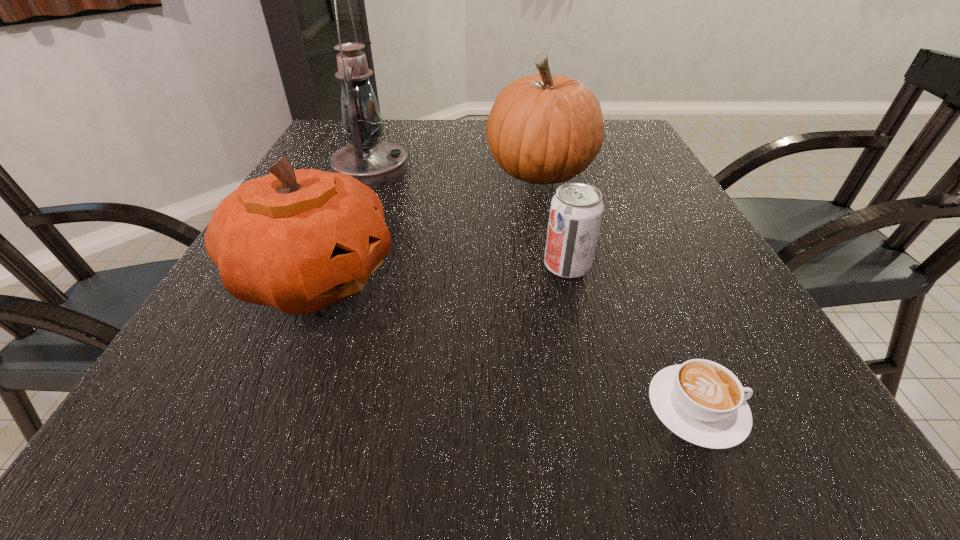
The height and width of the screenshot is (540, 960). I want to click on free space that satisfies the following two spatial constraints: 1. on the stem of the taller pumpkin; 2. on the left side of the fourth tallest object, so click(x=560, y=266).

Identify the location of free location that satisfies the following two spatial constraints: 1. on the front side of the soda can; 2. on the front-facing side of the left pumpkin. (570, 277).

This screenshot has width=960, height=540. Find the location of `blank area in the image that satisfies the following two spatial constraints: 1. on the stem of the taller pumpkin; 2. on the back side of the fourth tallest object`. blank area in the image that satisfies the following two spatial constraints: 1. on the stem of the taller pumpkin; 2. on the back side of the fourth tallest object is located at coordinates (560, 266).